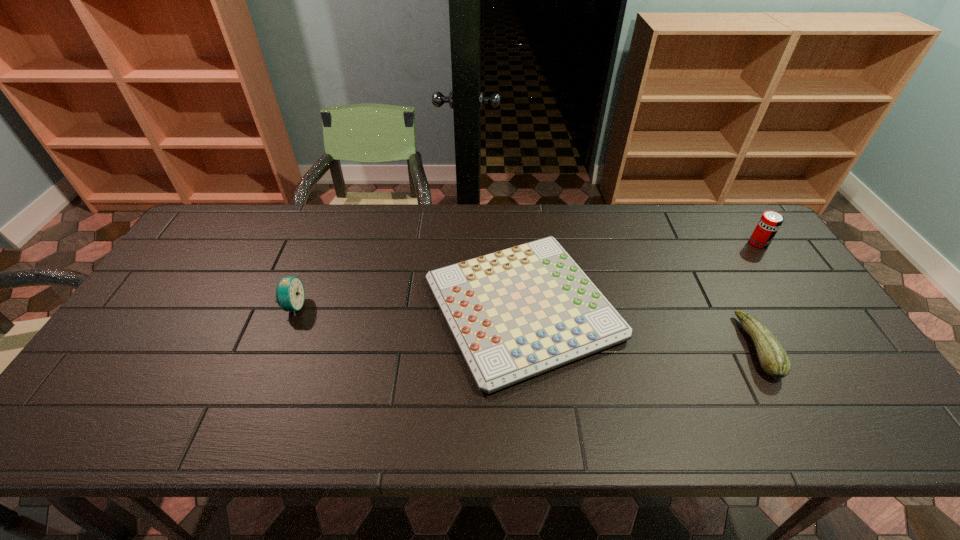
Identify the location of free location located 0.310m at the stem end of the second object from right to left. (623, 347).

Locate an element on the screen. The image size is (960, 540). blank area located 0.370m on the right of the second object from left to right is located at coordinates (756, 308).

This screenshot has width=960, height=540. In order to click on can situated at the far edge in this screenshot , I will do `click(770, 222)`.

Image resolution: width=960 pixels, height=540 pixels. Identify the location of gameboard present at the far edge. (516, 313).

This screenshot has height=540, width=960. I want to click on object present at the right edge, so click(770, 222).

Locate an element on the screen. This screenshot has width=960, height=540. object that is at the far right corner is located at coordinates (770, 222).

Where is `vacant point at the far edge`? vacant point at the far edge is located at coordinates (330, 223).

The image size is (960, 540). In order to click on free space at the near edge of the desktop in this screenshot , I will do `click(333, 425)`.

In the image, there is a desktop. Where is `vacant area at the left edge`? The width and height of the screenshot is (960, 540). vacant area at the left edge is located at coordinates (183, 263).

Locate an element on the screen. free region at the right edge is located at coordinates (792, 274).